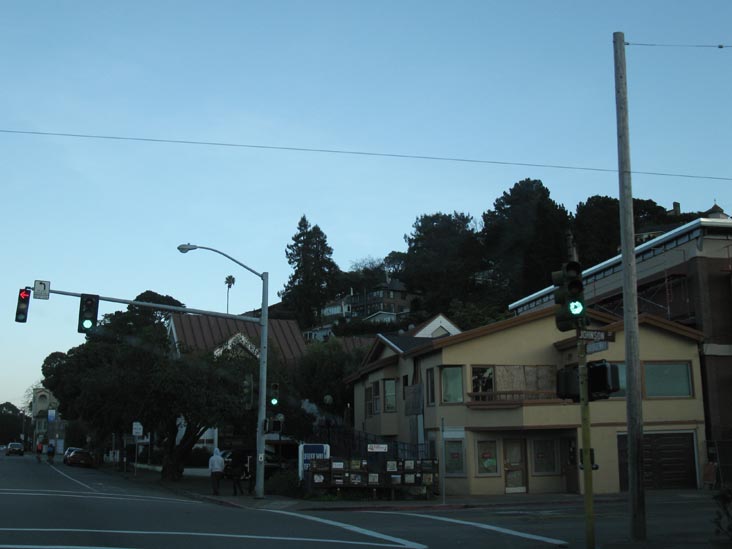
Find the location of a particular element. The image size is (732, 549). electrical wire is located at coordinates (339, 151), (679, 44).